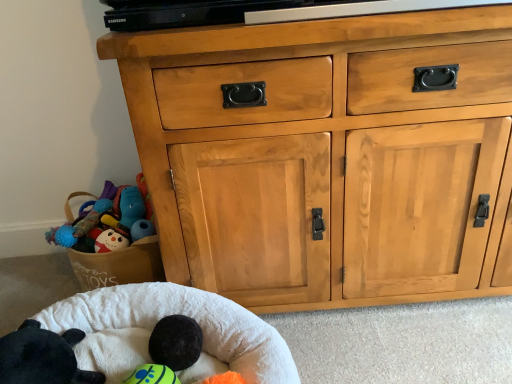
Measure the distance between point (x=151, y=304) and camera.

3.56 feet.

Identify the location of black plush toy at lower left. (42, 357).

What do you see at coordinates (326, 156) in the screenshot? I see `natural wood cabinet at center` at bounding box center [326, 156].

At what (x,y) coordinates should I click in order to perform the action: click on white soft infant bed at lower left. Please return your answer as a coordinate pair (x, y). Image resolution: width=512 pixels, height=384 pixels. Looking at the image, I should click on [x=183, y=314].

From the image's perspective, is natural wood cabinet at center located above or below black plush toy at lower left?

Based on their image positions, natural wood cabinet at center is located above black plush toy at lower left.

From a real-world perspective, which object rests below the other?

In real-world perspective, black plush toy at lower left is lower.

Where is `the chest of drawers located behind the black plush toy at lower left`? the chest of drawers located behind the black plush toy at lower left is located at coordinates pyautogui.click(x=326, y=156).

Which point is more forward, (44,368) or (394,117)?

The point (44,368) is in front.

Looking at their sizes, would you say black plush toy at lower left is wider or thinner than natural wood cabinet at center?

black plush toy at lower left is thinner than natural wood cabinet at center.

Between black plush toy at lower left and natural wood cabinet at center, which one appears on the left side from the viewer's perspective?

From the viewer's perspective, black plush toy at lower left appears more on the left side.

Considering the sizes of objects black plush toy at lower left and natural wood cabinet at center in the image provided, who is bigger, black plush toy at lower left or natural wood cabinet at center?

With larger size is natural wood cabinet at center.

Can you confirm if white soft infant bed at lower left is thinner than black plush toy at lower left?

No.

This screenshot has height=384, width=512. Find the location of `infant bed directly beneath the black plush toy at lower left (from a real-world perspective)`. infant bed directly beneath the black plush toy at lower left (from a real-world perspective) is located at coordinates (183, 314).

From a real-world perspective, is white soft infant bed at lower left above or below black plush toy at lower left?

white soft infant bed at lower left is situated lower than black plush toy at lower left in the real world.

From the image's perspective, is white soft infant bed at lower left positioned above or below natural wood cabinet at center?

From the image's perspective, white soft infant bed at lower left appears below natural wood cabinet at center.

Does white soft infant bed at lower left touch natural wood cabinet at center?

There is a gap between white soft infant bed at lower left and natural wood cabinet at center.

Which is more to the right, white soft infant bed at lower left or natural wood cabinet at center?

natural wood cabinet at center is more to the right.

Is white soft infant bed at lower left surrounded by black plush toy at lower left?

No, black plush toy at lower left does not contain white soft infant bed at lower left.

Is black plush toy at lower left oriented away from white soft infant bed at lower left?

Yes, black plush toy at lower left is facing away from white soft infant bed at lower left.

From the image's perspective, is black plush toy at lower left above or below white soft infant bed at lower left?

Based on their image positions, black plush toy at lower left is located above white soft infant bed at lower left.

From a real-world perspective, who is located higher, natural wood cabinet at center or white soft infant bed at lower left?

In real-world perspective, natural wood cabinet at center is above.

From the picture: Is natural wood cabinet at center not inside white soft infant bed at lower left?

Absolutely, natural wood cabinet at center is external to white soft infant bed at lower left.

Is natural wood cabinet at center at the right side of white soft infant bed at lower left?

Yes, natural wood cabinet at center is to the right of white soft infant bed at lower left.

Who is taller, natural wood cabinet at center or white soft infant bed at lower left?

Standing taller between the two is natural wood cabinet at center.

At what (x,y) coordinates should I click in order to perform the action: click on chest of drawers that appears on the right of black plush toy at lower left. Please return your answer as a coordinate pair (x, y). The height and width of the screenshot is (384, 512). Looking at the image, I should click on (326, 156).

You are a GUI agent. You are given a task and a screenshot of the screen. Output one action in this format:
    pyautogui.click(x=<x>, y=<y>)
    Task: Click on the chest of drawers lying behind the black plush toy at lower left
    This screenshot has height=384, width=512.
    Given the screenshot: What is the action you would take?
    click(326, 156)

Looking at the image, which one is located closer to natural wood cabinet at center, white soft infant bed at lower left or black plush toy at lower left?

Among the two, white soft infant bed at lower left is located nearer to natural wood cabinet at center.

Considering their positions, is white soft infant bed at lower left positioned closer to black plush toy at lower left than natural wood cabinet at center?

white soft infant bed at lower left lies closer to black plush toy at lower left than the other object.

Considering their positions, is black plush toy at lower left positioned further to white soft infant bed at lower left than natural wood cabinet at center?

natural wood cabinet at center lies further to white soft infant bed at lower left than the other object.

Based on their spatial positions, is natural wood cabinet at center or white soft infant bed at lower left closer to black plush toy at lower left?

Among the two, white soft infant bed at lower left is located nearer to black plush toy at lower left.

Which object lies nearer to the anchor point natural wood cabinet at center, black plush toy at lower left or white soft infant bed at lower left?

white soft infant bed at lower left.

Estimate the real-world distances between objects in this image. Which object is closer to white soft infant bed at lower left, natural wood cabinet at center or black plush toy at lower left?

The object closer to white soft infant bed at lower left is black plush toy at lower left.

This screenshot has height=384, width=512. I want to click on infant bed between black plush toy at lower left and natural wood cabinet at center from left to right, so click(183, 314).